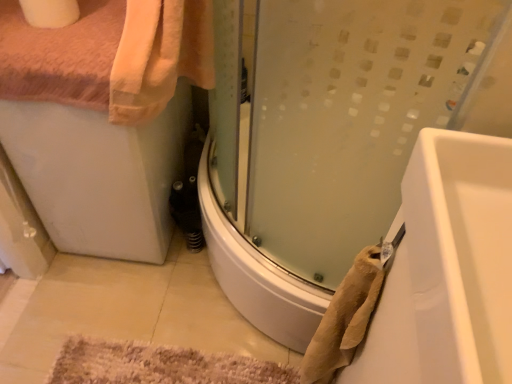
Question: Choose the correct answer: Is white glossy bathtub at lower right inside satin glass shower door at center or outside it?

Choices:
 (A) inside
 (B) outside

Answer: (B)

Question: Considering their positions, is white glossy bathtub at lower right located in front of or behind satin glass shower door at center?

Choices:
 (A) front
 (B) behind

Answer: (A)

Question: Based on their relative distances, which object is farther from the satin glass shower door at center?

Choices:
 (A) beige textured bath mat at lower center
 (B) white matte toilet paper at upper left
 (C) white glossy bathtub at lower right
 (D) beige textured towel at lower right

Answer: (B)

Question: Estimate the real-world distances between objects in this image. Which object is closer to the beige textured bath mat at lower center?

Choices:
 (A) beige textured towel at lower right
 (B) white matte toilet paper at upper left
 (C) satin glass shower door at center
 (D) white glossy bathtub at lower right

Answer: (A)